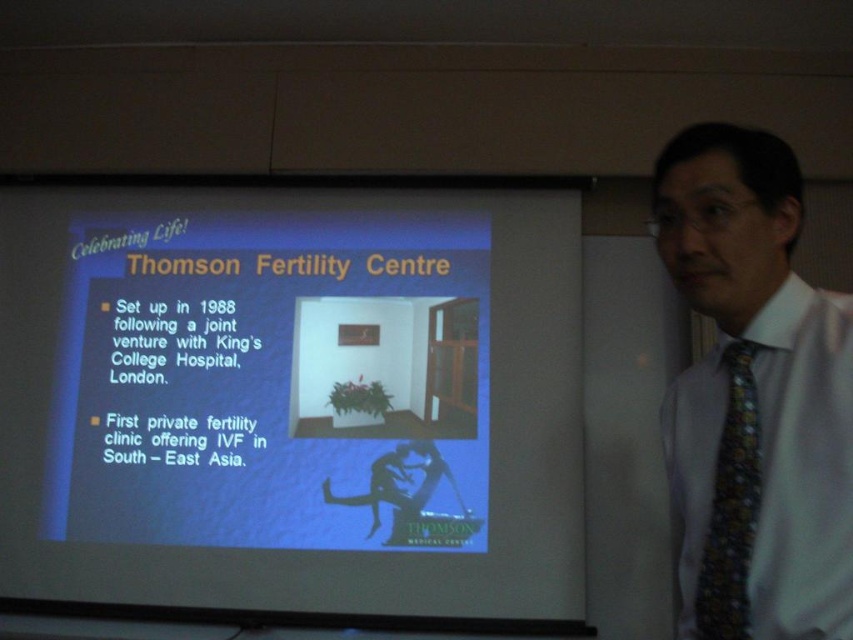
Question: Which point is closer to the camera?

Choices:
 (A) (701, 540)
 (B) (412, 394)

Answer: (A)

Question: Is white silk shirt at right positioned at the back of multicolored patterned tie at right?

Choices:
 (A) no
 (B) yes

Answer: (A)

Question: Observing the image, what is the correct spatial positioning of blue matte screen at center in reference to multicolored patterned tie at right?

Choices:
 (A) above
 (B) below

Answer: (A)

Question: Which point is closer to the camera taking this photo?

Choices:
 (A) (149, 232)
 (B) (793, 548)
 (C) (721, 461)

Answer: (B)

Question: Is white silk shirt at right to the right of multicolored patterned tie at right from the viewer's perspective?

Choices:
 (A) no
 (B) yes

Answer: (B)

Question: Which point is closer to the camera?

Choices:
 (A) blue matte screen at center
 (B) multicolored patterned tie at right

Answer: (B)